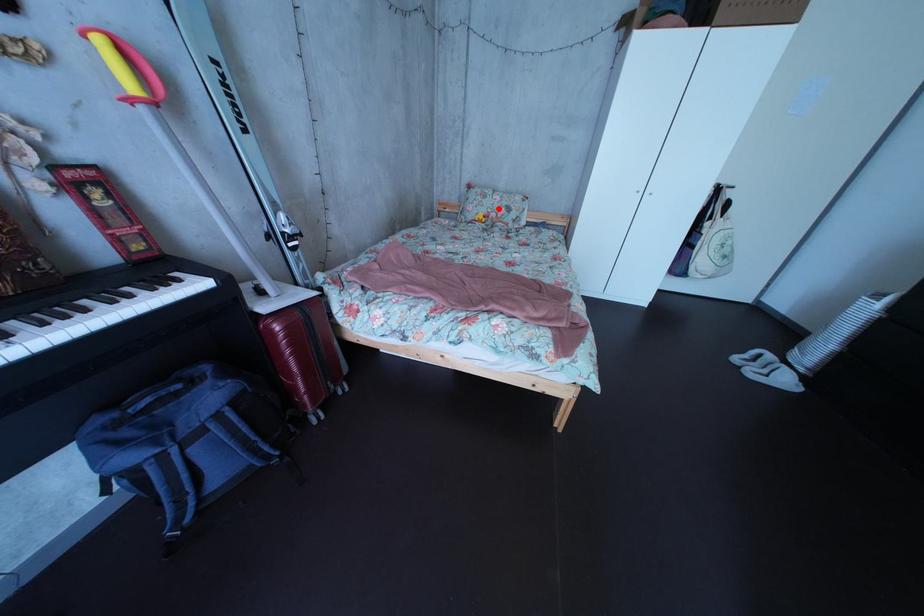
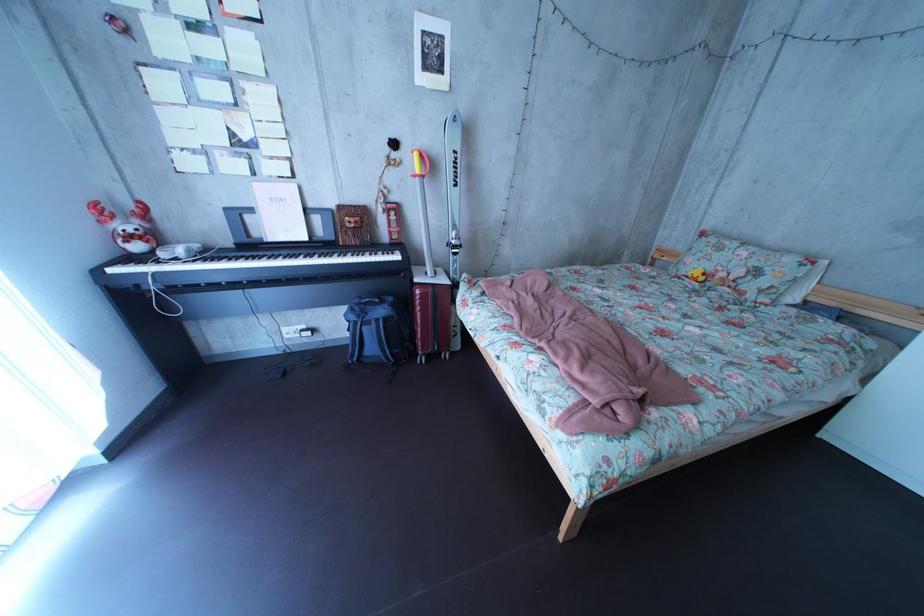
Question: I am providing you with two images of the same scene from different viewpoints. Given a red point in image1, look at the same physical point in image2. Is it:

Choices:
 (A) Closer to the viewpoint
 (B) Farther from the viewpoint

Answer: (B)